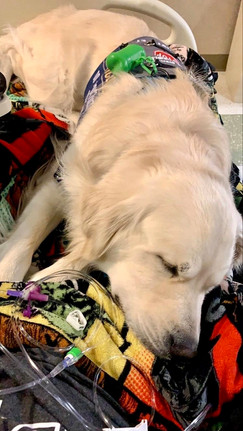
This screenshot has width=243, height=431. In order to click on blanket in this screenshot , I will do pos(110,348).